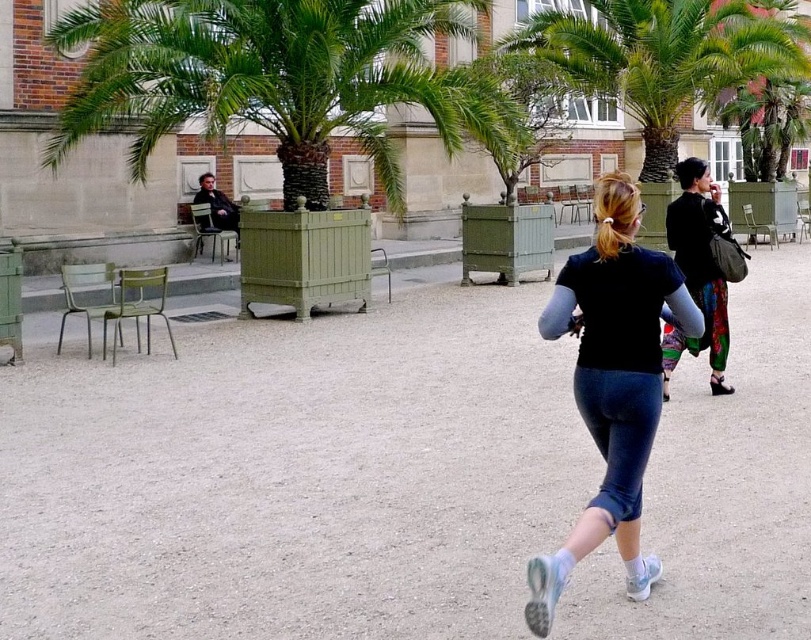
You are a photographer standing in the plaza. You notice the blonde hair at center and the matte black jacket at left. Which object would appear bigger in your camera viewfinder?

The blonde hair at center appears bigger in the camera viewfinder because it is larger in size than the matte black jacket at left.

You are standing in the courtyard and want to walk from the point closer to you to the point farther away. Which path should you take? The points are point [195,358] and point [537,577].

You should walk from point [195,358] to point [537,577] because point [195,358] is closer to you and point [537,577] is farther away.

From the picture: You are a photographer planning to capture the scene of the woman jogging. You notice the gray gravel at center and the dark blue jersey at center. Which object would you need to adjust your focus settings for to ensure clarity, considering their size differences?

The gray gravel at center has a larger size compared to the dark blue jersey at center, so you should adjust your focus settings for the gray gravel at center to ensure it appears clear in the photo.